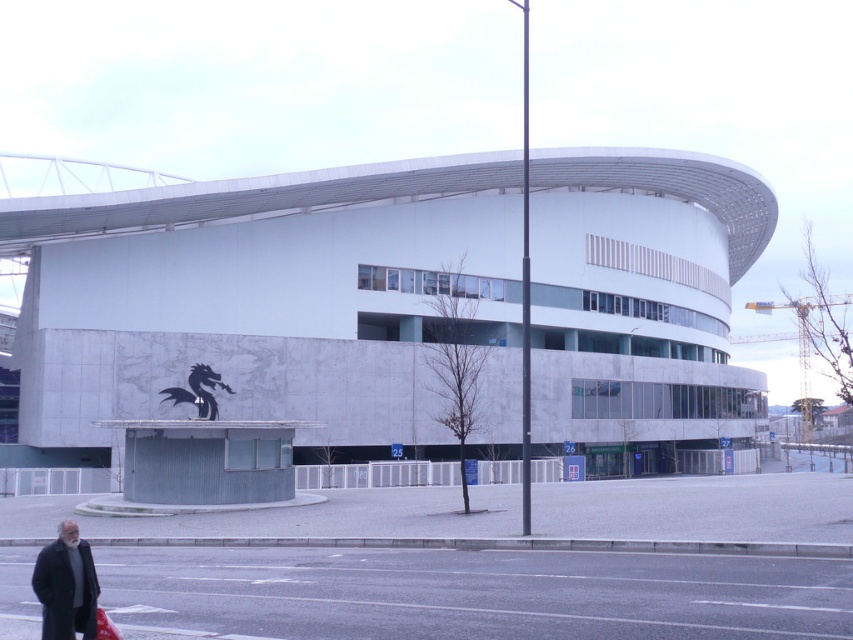
You are standing in front of the white marble stadium at center and want to find the dark gray wool coat at lower left. Which direction should you turn to locate it?

The dark gray wool coat at lower left is to the left of the white marble stadium at center, so you should turn left to locate it.

You are a photographer planning to take a wide shot of the white marble stadium at center and the dark gray wool coat at lower left. Which object should you focus on first to ensure it is in sharp focus if you want both to be clear?

Since the white marble stadium at center is larger than the dark gray wool coat at lower left, you should focus on the white marble stadium at center first to ensure both are in sharp focus.

You are a visitor standing at the entrance of the white marble stadium at center. You notice the dark gray wool coat at lower left nearby. Can you determine if the stadium is taller than the coat?

The white marble stadium at center is taller than the dark gray wool coat at lower left, so yes, the stadium is taller than the coat.